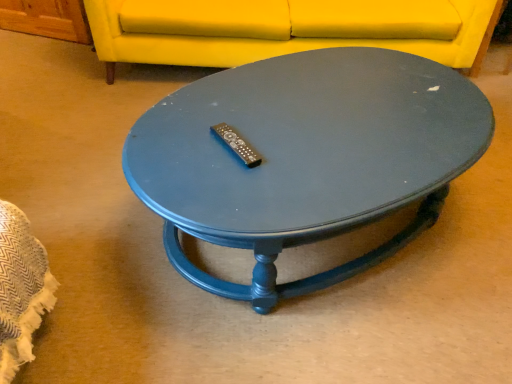
Identify the location of free point to the left of matte blue coffee table at center. (83, 188).